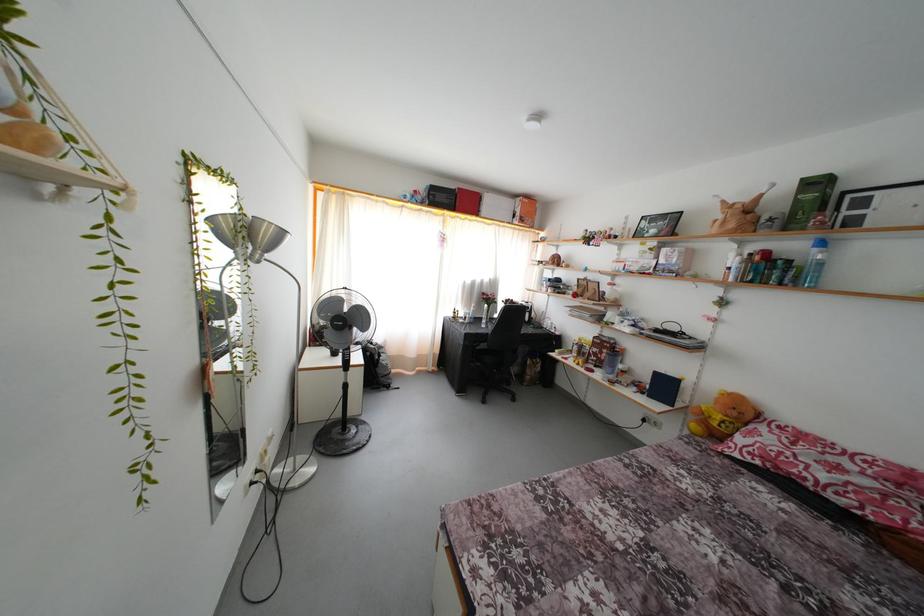
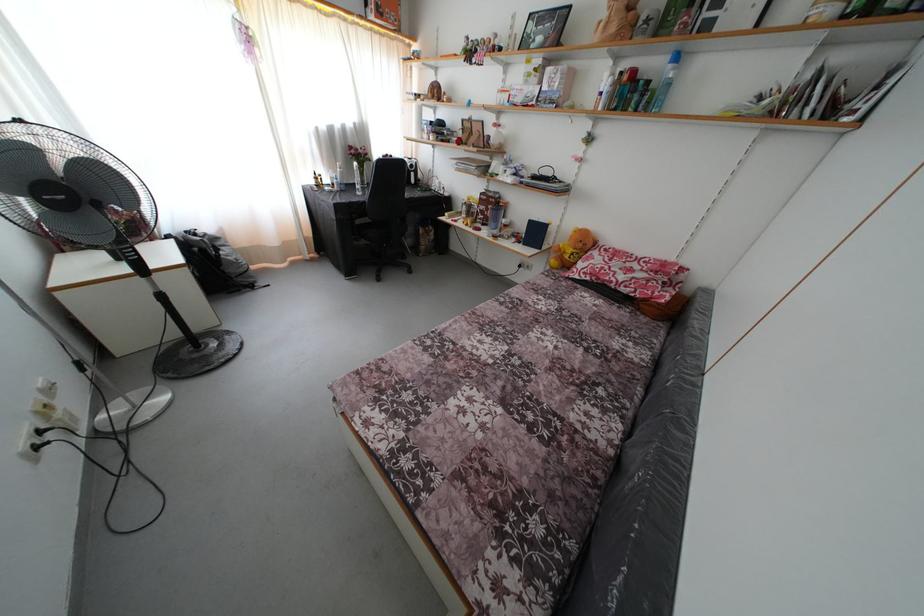
In the second image, find the point that corresponds to point 482,354 in the first image.

(362, 228)